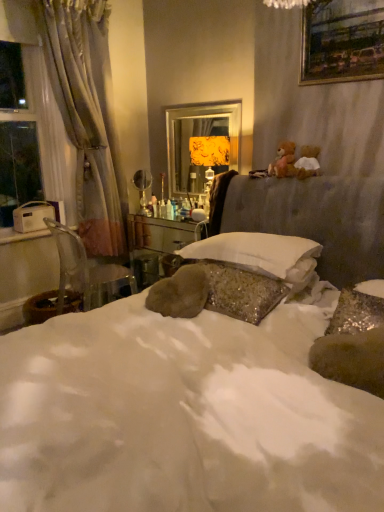
Question: From a real-world perspective, relative to gold-framed painting at upper right, is wooden vanity at center vertically above or below?

Choices:
 (A) above
 (B) below

Answer: (B)

Question: In the image, is wooden vanity at center on the left side or the right side of gold-framed painting at upper right?

Choices:
 (A) left
 (B) right

Answer: (A)

Question: Considering the real-world distances, which object is farthest from the transparent glass window at left?

Choices:
 (A) gold-framed painting at upper right
 (B) metallic gold mirror at center
 (C) white soft pillow at center
 (D) white sheer curtain at left
 (E) wooden vanity at center

Answer: (A)

Question: Based on their relative distances, which object is nearer to the wooden vanity at center?

Choices:
 (A) white soft pillow at center
 (B) clear plastic chair at left
 (C) white sheer curtain at left
 (D) metallic gold mirror at center
 (E) gold-framed painting at upper right

Answer: (B)